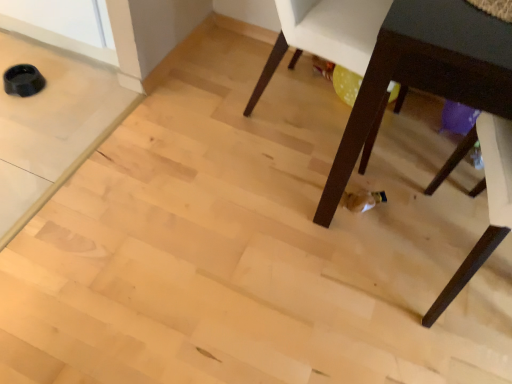
Question: Should I look upward or downward to see white plastic chair at center, which is the first chair in top-to-bottom order?

Choices:
 (A) up
 (B) down

Answer: (A)

Question: Should I look upward or downward to see dark wood chair at lower right, the second chair from the top?

Choices:
 (A) down
 (B) up

Answer: (A)

Question: Considering the relative sizes of dark wood table at lower right and dark wood chair at lower right, arranged as the 2th chair when viewed from the left, in the image provided, is dark wood table at lower right bigger than dark wood chair at lower right, arranged as the 2th chair when viewed from the left,?

Choices:
 (A) no
 (B) yes

Answer: (B)

Question: Does dark wood table at lower right appear on the right side of dark wood chair at lower right, the second chair from the top?

Choices:
 (A) yes
 (B) no

Answer: (B)

Question: Considering the relative sizes of dark wood table at lower right and dark wood chair at lower right, arranged as the 2th chair when viewed from the left, in the image provided, is dark wood table at lower right smaller than dark wood chair at lower right, arranged as the 2th chair when viewed from the left,?

Choices:
 (A) no
 (B) yes

Answer: (A)

Question: From the image's perspective, is dark wood table at lower right located beneath dark wood chair at lower right, the first chair viewed from the right?

Choices:
 (A) no
 (B) yes

Answer: (A)

Question: From the image's perspective, is dark wood table at lower right on top of dark wood chair at lower right, the first chair viewed from the right?

Choices:
 (A) yes
 (B) no

Answer: (A)

Question: Is dark wood chair at lower right, acting as the 1th chair starting from the bottom, at the back of dark wood table at lower right?

Choices:
 (A) yes
 (B) no

Answer: (B)

Question: From the image's perspective, is dark wood chair at lower right, the first chair viewed from the right, under dark wood table at lower right?

Choices:
 (A) yes
 (B) no

Answer: (A)

Question: Is dark wood chair at lower right, the first chair viewed from the right, to the right of dark wood table at lower right from the viewer's perspective?

Choices:
 (A) no
 (B) yes

Answer: (B)

Question: Are dark wood chair at lower right, the first chair viewed from the right, and dark wood table at lower right making contact?

Choices:
 (A) yes
 (B) no

Answer: (B)

Question: From a real-world perspective, does dark wood chair at lower right, acting as the 1th chair starting from the bottom, stand above dark wood table at lower right?

Choices:
 (A) yes
 (B) no

Answer: (B)

Question: Does dark wood chair at lower right, arranged as the 2th chair when viewed from the left, have a larger size compared to dark wood table at lower right?

Choices:
 (A) no
 (B) yes

Answer: (A)

Question: Is dark wood chair at lower right, arranged as the 2th chair when viewed from the left, positioned before dark wood table at lower right?

Choices:
 (A) yes
 (B) no

Answer: (B)

Question: From the image's perspective, is dark wood table at lower right located above white plastic chair at center, acting as the 2th chair starting from the right?

Choices:
 (A) no
 (B) yes

Answer: (A)